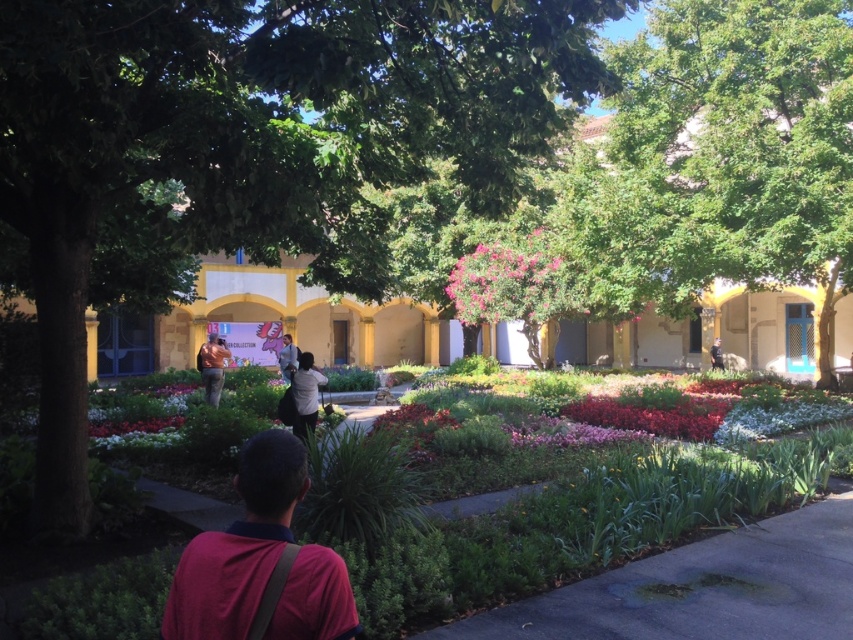
You are a photographer trying to capture the entire scene in one shot. Given that the green leafy tree at upper right and the dark red shirt at lower left are both in your frame, which object occupies more horizontal space in the image?

The green leafy tree at upper right occupies more horizontal space in the image because its width is larger than that of the dark red shirt at lower left.

You are a photographer trying to capture the pink matte flower at center while ensuring the dark red shirt at lower left is not in the frame. Based on their positions, is this possible?

The dark red shirt at lower left is below the pink matte flower at center, so adjusting the camera angle upwards could exclude the shirt while keeping the flower in view.